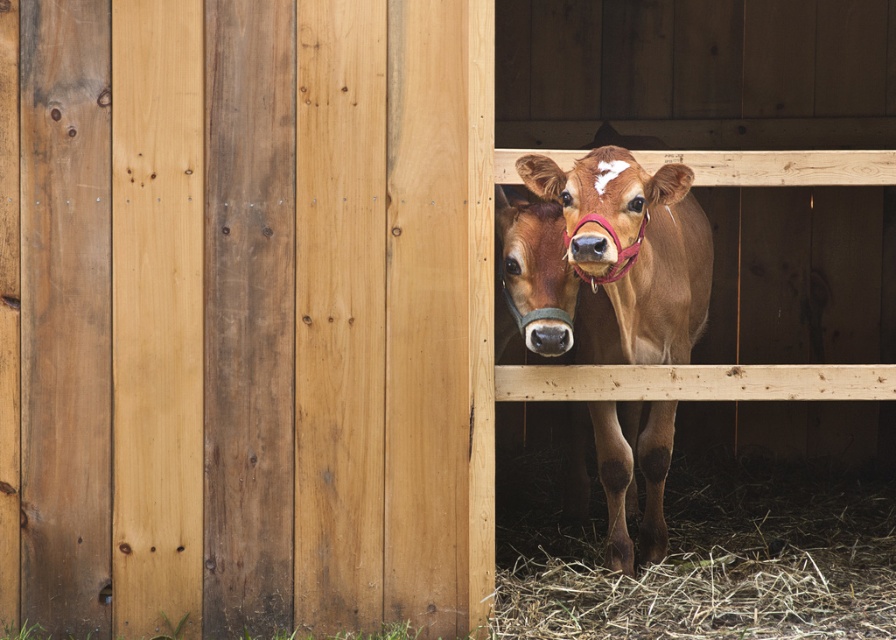
You are a farmer who needs to enter the barn stall to feed the cows. The barn door is the natural wood barn door at center, and the cow nose is the brown matte cow nose at center. Can you open the barn door without getting too close to the cow nose?

The natural wood barn door at center is 1.09 meters away from the brown matte cow nose at center. Since 1.09 meters is a safe distance, you can open the barn door without getting too close to the cow nose.

You are a farmer checking the stalls. You notice the brown matte cow at center and the brown matte cow nose at center. Which one is located below the other?

The brown matte cow at center is positioned under brown matte cow nose at center, so the cow nose is above the cow.

You are a farmer standing at the entrance of the barn. You want to open the natural wood barn door at center to let the cows out. Considering the barn door is 4.02 meters away from you, is it within a comfortable reach for you to grab the door handle?

The natural wood barn door at center is 4.02 meters away from you, so it is within a comfortable reach to grab the door handle since the average human arm span is about 1.5 meters, but the distance is too far to comfortably reach without moving closer.